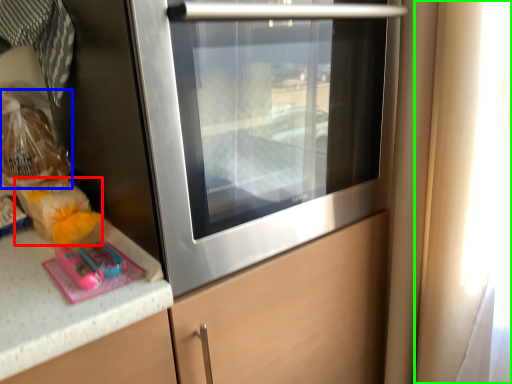
Question: Considering the real-world distances, which object is farthest from food (highlighted by a red box)? food (highlighted by a blue box) or window (highlighted by a green box)?

Choices:
 (A) food
 (B) window

Answer: (B)